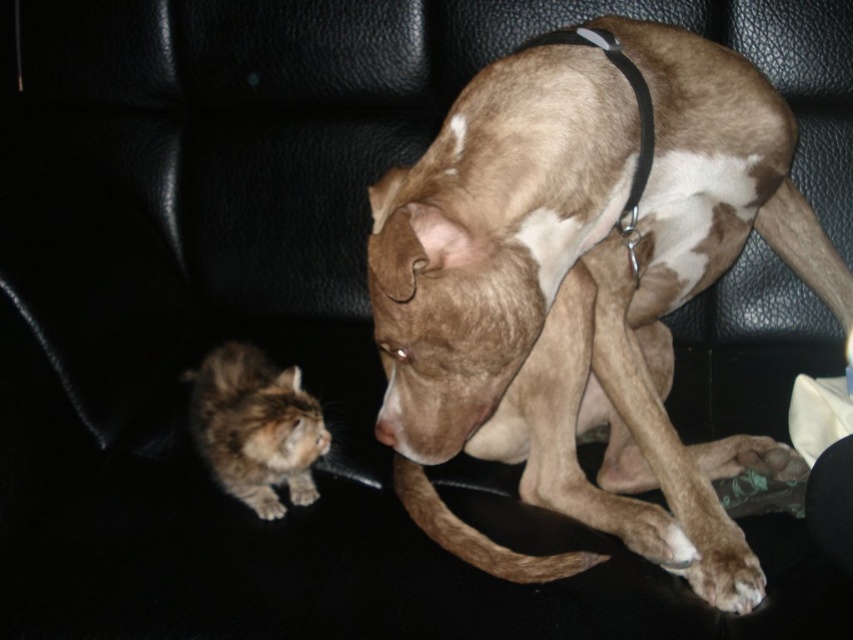
Question: Does brown speckled fur dog at center have a lesser width compared to fluffy brown cat at lower left?

Choices:
 (A) no
 (B) yes

Answer: (A)

Question: Is brown speckled fur dog at center wider than fluffy brown cat at lower left?

Choices:
 (A) no
 (B) yes

Answer: (B)

Question: Among these points, which one is farthest from the camera?

Choices:
 (A) (207, 412)
 (B) (492, 456)

Answer: (A)

Question: Which object is farther from the camera taking this photo?

Choices:
 (A) brown speckled fur dog at center
 (B) fluffy brown cat at lower left

Answer: (B)

Question: Is brown speckled fur dog at center above fluffy brown cat at lower left?

Choices:
 (A) no
 (B) yes

Answer: (B)

Question: Which of the following is the closest to the observer?

Choices:
 (A) (316, 416)
 (B) (619, 241)

Answer: (B)